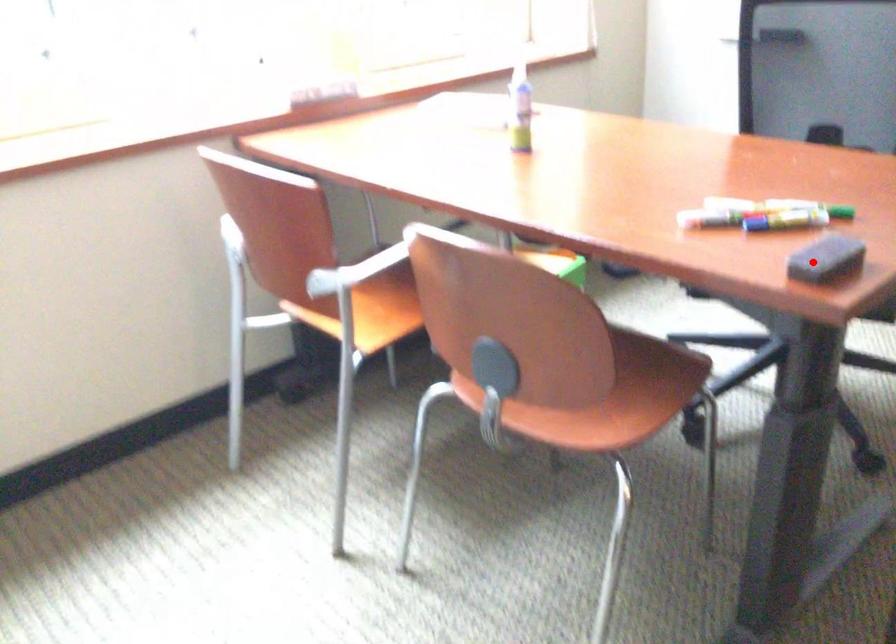
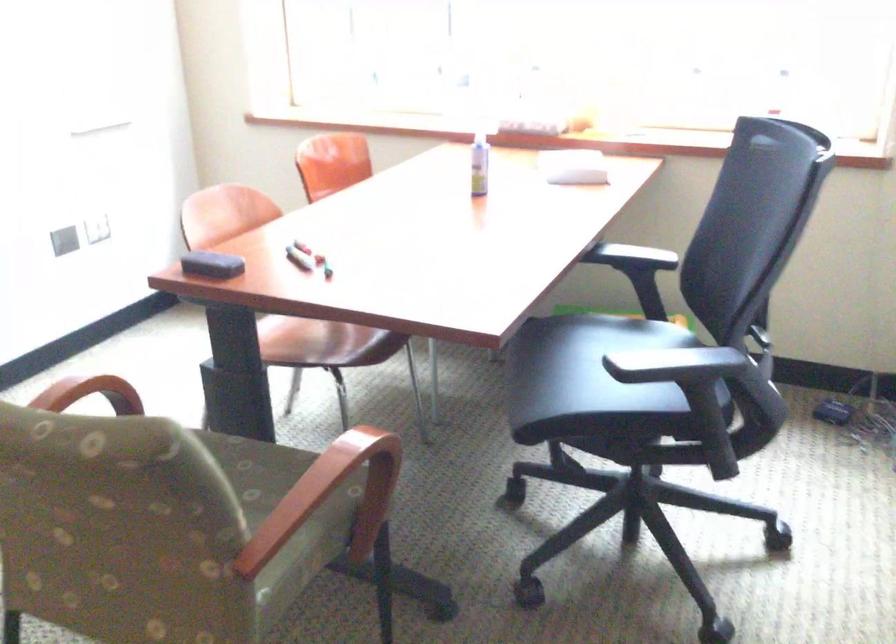
Question: I am providing you with two images of the same scene from different viewpoints. Given a red point in image1, look at the same physical point in image2. Is it:

Choices:
 (A) Closer to the viewpoint
 (B) Farther from the viewpoint

Answer: (B)